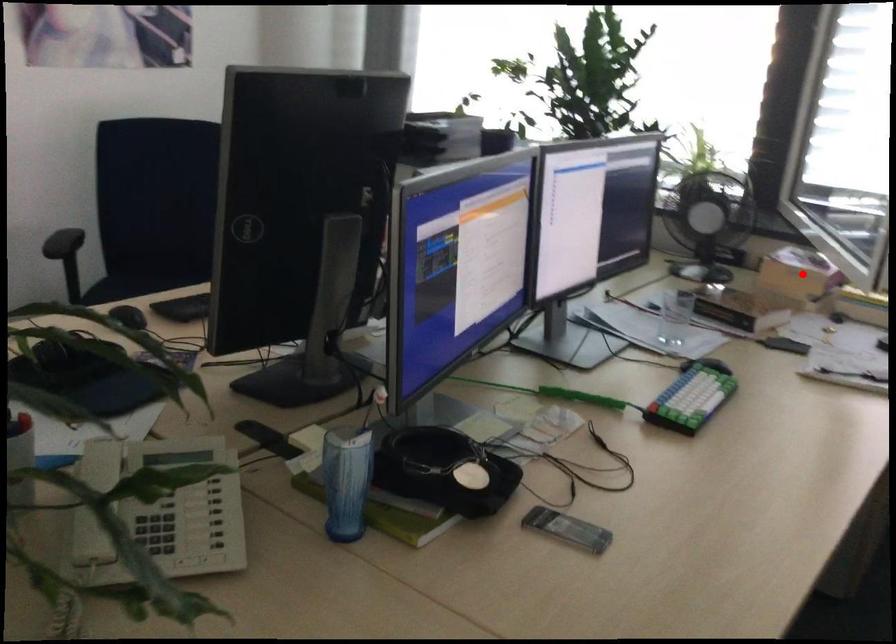
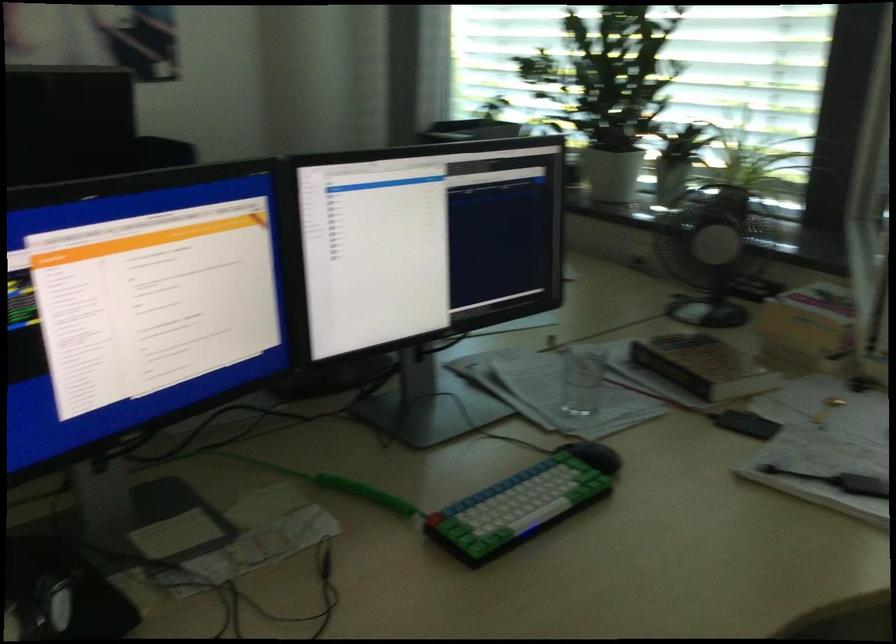
The point at the highlighted location is marked in the first image. Where is the corresponding point in the second image?

(810, 326)